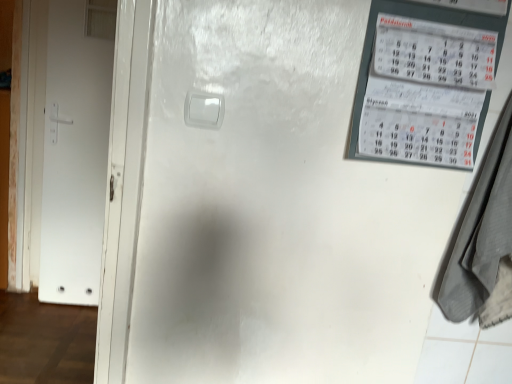
Question: Should I look upward or downward to see gray fabric laundry at right?

Choices:
 (A) down
 (B) up

Answer: (A)

Question: Does white matte door at left have a lesser width compared to gray fabric laundry at right?

Choices:
 (A) no
 (B) yes

Answer: (B)

Question: From a real-world perspective, is white matte door at left beneath gray fabric laundry at right?

Choices:
 (A) yes
 (B) no

Answer: (A)

Question: Is white matte door at left far away from gray fabric laundry at right?

Choices:
 (A) yes
 (B) no

Answer: (A)

Question: Considering the relative sizes of white matte door at left and gray fabric laundry at right in the image provided, is white matte door at left smaller than gray fabric laundry at right?

Choices:
 (A) yes
 (B) no

Answer: (A)

Question: Does white matte door at left have a greater width compared to gray fabric laundry at right?

Choices:
 (A) yes
 (B) no

Answer: (B)

Question: Is white matte door at left shorter than gray fabric laundry at right?

Choices:
 (A) yes
 (B) no

Answer: (B)

Question: From a real-world perspective, is gray fabric laundry at right below white matte door at left?

Choices:
 (A) yes
 (B) no

Answer: (B)

Question: From the image's perspective, would you say gray fabric laundry at right is positioned over white matte door at left?

Choices:
 (A) yes
 (B) no

Answer: (B)

Question: Is gray fabric laundry at right turned away from white matte door at left?

Choices:
 (A) yes
 (B) no

Answer: (B)

Question: Is gray fabric laundry at right to the right of white matte door at left from the viewer's perspective?

Choices:
 (A) no
 (B) yes

Answer: (B)

Question: Is white matte door at left located within gray fabric laundry at right?

Choices:
 (A) no
 (B) yes

Answer: (A)

Question: Is gray fabric laundry at right thinner than white matte door at left?

Choices:
 (A) no
 (B) yes

Answer: (A)

Question: Visually, is white matte door at left positioned to the left or to the right of gray fabric laundry at right?

Choices:
 (A) right
 (B) left

Answer: (B)